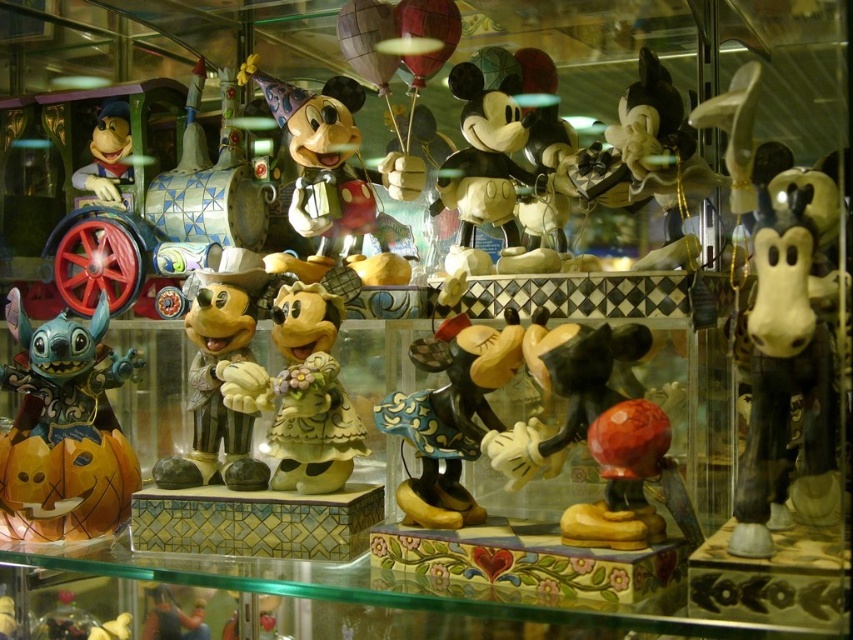
Question: Considering the relative positions of matte yellow mickey mouse at center and matte yellow figure at left in the image provided, where is matte yellow mickey mouse at center located with respect to matte yellow figure at left?

Choices:
 (A) below
 (B) above

Answer: (A)

Question: Which point is farther from the camera taking this photo?

Choices:
 (A) tap(109, 196)
 (B) tap(55, 452)
 (C) tap(444, 481)

Answer: (A)

Question: Which of these objects is positioned closest to the matte orange pumpkin at left?

Choices:
 (A) porcelain minnie mouse at center
 (B) matte yellow figure at left
 (C) matte yellow mickey mouse at center
 (D) matte ceramic mickey mouse at center

Answer: (D)

Question: Is matte orange pumpkin at left positioned at the back of matte yellow figure at left?

Choices:
 (A) no
 (B) yes

Answer: (A)

Question: Which of the following is the closest to the observer?

Choices:
 (A) matte yellow mickey mouse at center
 (B) porcelain minnie mouse at center
 (C) matte orange pumpkin at left

Answer: (A)

Question: In this image, where is matte orange pumpkin at left located relative to matte yellow figure at left?

Choices:
 (A) below
 (B) above

Answer: (A)